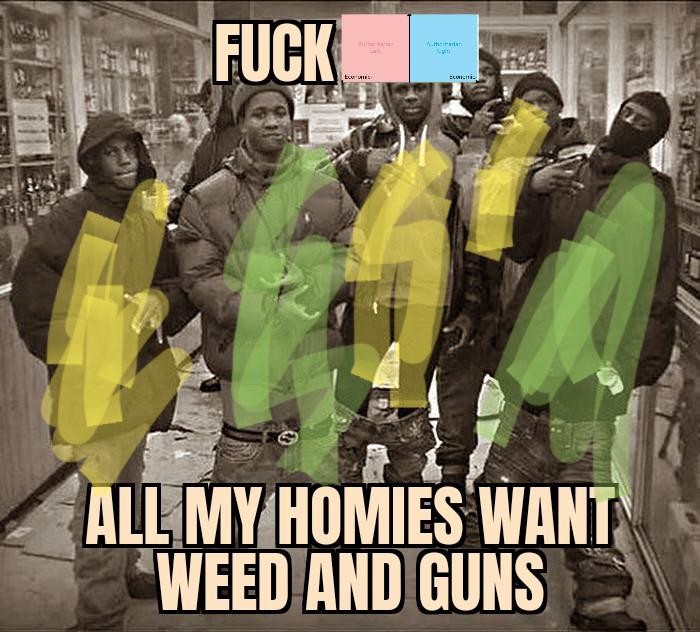
Where is `floor`? floor is located at coordinates (176, 451).